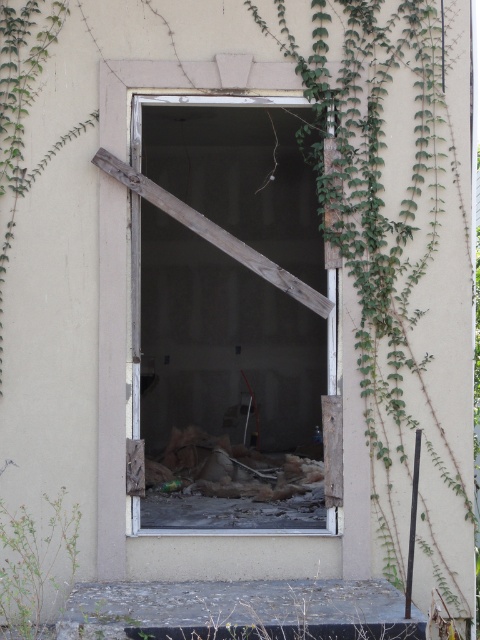
Question: Which of the following is the closest to the observer?

Choices:
 (A) (19, 573)
 (B) (315, 499)

Answer: (A)

Question: Can you confirm if wooden door at center is positioned above green leafy plant at lower left?

Choices:
 (A) yes
 (B) no

Answer: (A)

Question: Among these points, which one is farthest from the camera?

Choices:
 (A) (38, 628)
 (B) (214, 132)

Answer: (B)

Question: Where is wooden door at center located in relation to green leafy plant at lower left in the image?

Choices:
 (A) below
 (B) above

Answer: (B)

Question: Does wooden door at center appear under green leafy plant at lower left?

Choices:
 (A) no
 (B) yes

Answer: (A)

Question: Which point is closer to the camera?

Choices:
 (A) (24, 529)
 (B) (279, 337)

Answer: (A)